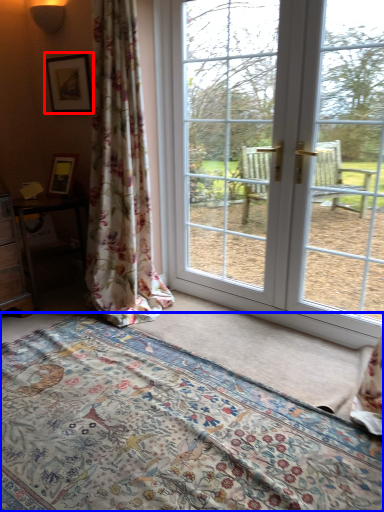
Question: Which object appears farthest to the camera in this image, picture frame (highlighted by a red box) or bed (highlighted by a blue box)?

Choices:
 (A) picture frame
 (B) bed

Answer: (A)